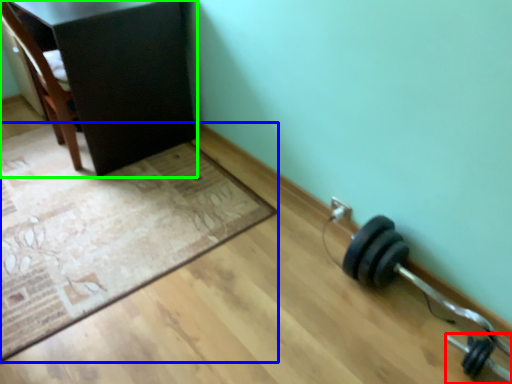
Question: Based on their relative distances, which object is farther from dumbbell (highlighted by a red box)? Choose from mat (highlighted by a blue box) and furniture (highlighted by a green box).

Choices:
 (A) mat
 (B) furniture

Answer: (B)